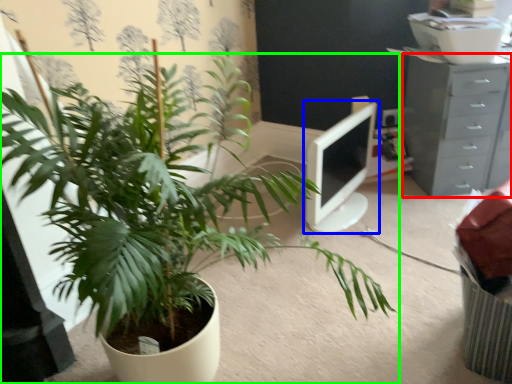
Question: Considering the real-world distances, which object is closest to chest of drawers (highlighted by a red box)? computer monitor (highlighted by a blue box) or houseplant (highlighted by a green box).

Choices:
 (A) computer monitor
 (B) houseplant

Answer: (A)